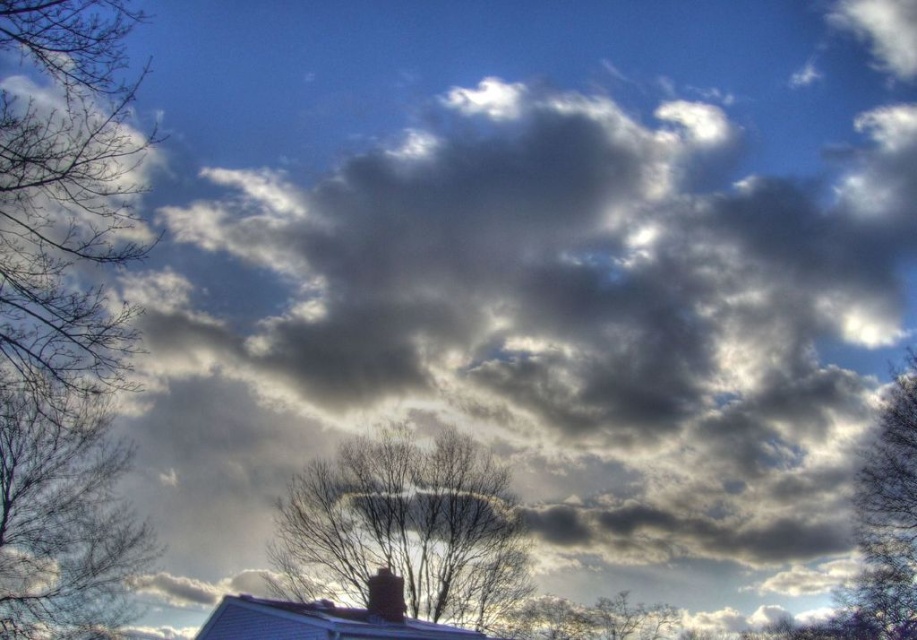
You are an ornithologist observing the scene. You notice two trees in the image. Which tree, the bare branches at center or the smooth bark tree at right, would likely provide a higher nesting spot for birds?

The bare branches at center is much taller than the smooth bark tree at right, so it would provide a higher nesting spot for birds.